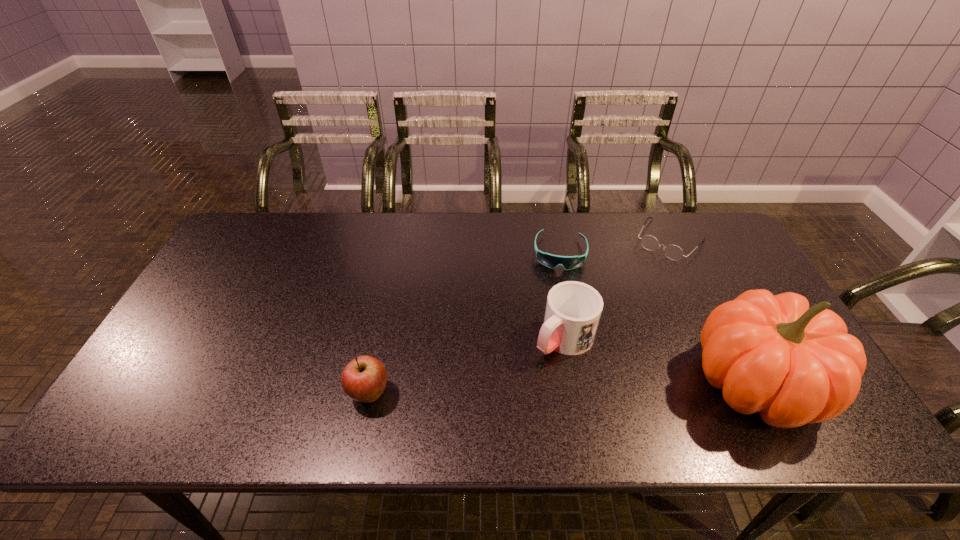
Identify the location of free spot between the spectacles and the sunglasses. (615, 246).

This screenshot has height=540, width=960. In order to click on vacant region between the leftmost object and the sunglasses in this screenshot , I will do `click(465, 323)`.

You are a GUI agent. You are given a task and a screenshot of the screen. Output one action in this format:
    pyautogui.click(x=<x>, y=<y>)
    Task: Click on the empty location between the tallest object and the mug
    
    Given the screenshot: What is the action you would take?
    pyautogui.click(x=659, y=361)

The width and height of the screenshot is (960, 540). Find the location of `vacant region between the tallest object and the mug`. vacant region between the tallest object and the mug is located at coordinates (659, 361).

At what (x,y) coordinates should I click in order to perform the action: click on vacant space that's between the pumpkin and the mug. Please return your answer as a coordinate pair (x, y). The width and height of the screenshot is (960, 540). Looking at the image, I should click on (659, 361).

Image resolution: width=960 pixels, height=540 pixels. What are the coordinates of `free space between the mug and the apple` in the screenshot? It's located at (467, 366).

This screenshot has height=540, width=960. Identify the location of vacant space in between the leftmost object and the mug. (467, 366).

Find the location of a particular element. The image size is (960, 540). free point between the sunglasses and the leftmost object is located at coordinates (465, 323).

Where is `free space between the apple and the sunglasses`? Image resolution: width=960 pixels, height=540 pixels. free space between the apple and the sunglasses is located at coordinates (465, 323).

The height and width of the screenshot is (540, 960). I want to click on object that is the closest to the spectacles, so coord(551,261).